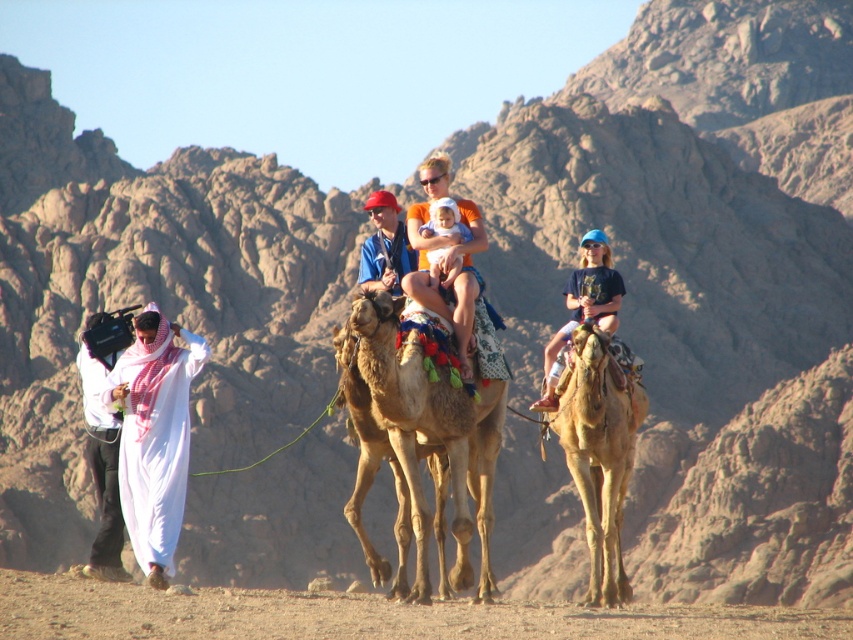
Question: Does dusty sand at lower center come in front of white clothed man at left?

Choices:
 (A) no
 (B) yes

Answer: (B)

Question: Estimate the real-world distances between objects in this image. Which object is closer to the dusty sand at lower center?

Choices:
 (A) matte blue shirt at center
 (B) brown textured camel at center
 (C) orange cotton shirt at center

Answer: (B)

Question: Which point is closer to the camera?

Choices:
 (A) matte blue shirt at center
 (B) dusty sand at lower center
 (C) light brown textured camel at center

Answer: (B)

Question: Which of the following is the farthest from the observer?

Choices:
 (A) (136, 368)
 (B) (80, 580)
 (C) (619, 554)
 (D) (358, 273)

Answer: (D)

Question: Can you confirm if light brown textured camel at center is positioned above orange cotton shirt at center?

Choices:
 (A) no
 (B) yes

Answer: (A)

Question: Can you confirm if blue cotton shirt at right is thinner than matte blue shirt at center?

Choices:
 (A) yes
 (B) no

Answer: (A)